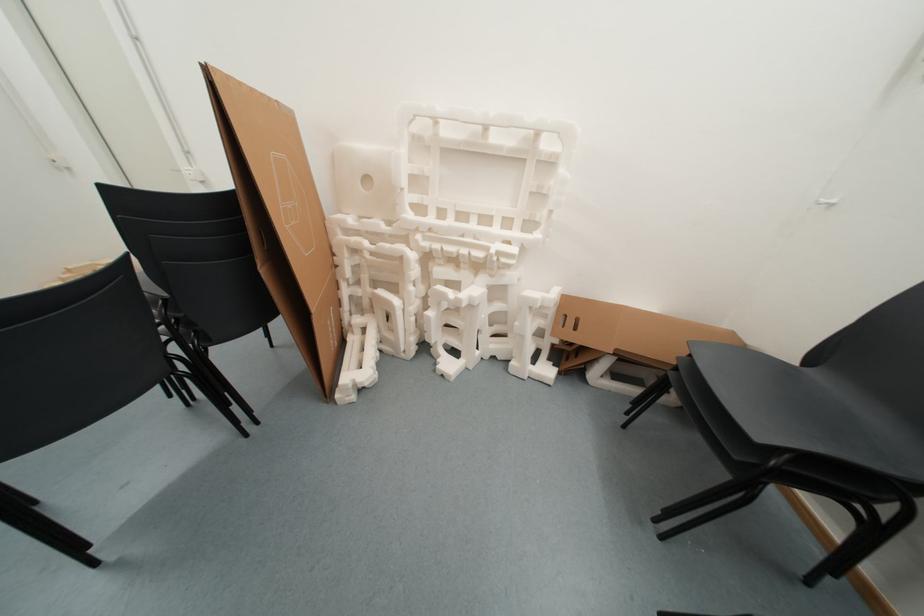
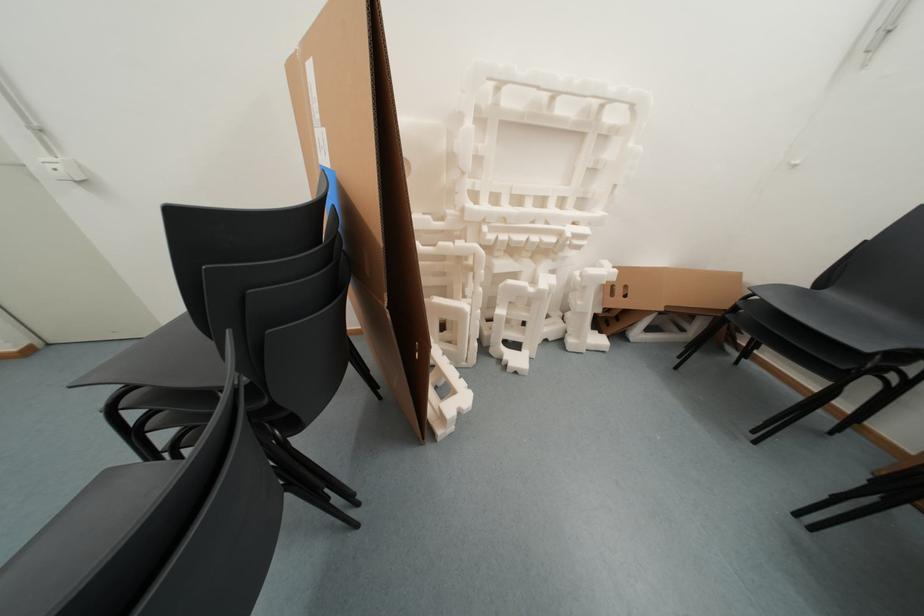
Question: How did the camera likely rotate?

Choices:
 (A) Left
 (B) Right
 (C) Up
 (D) Down

Answer: (B)